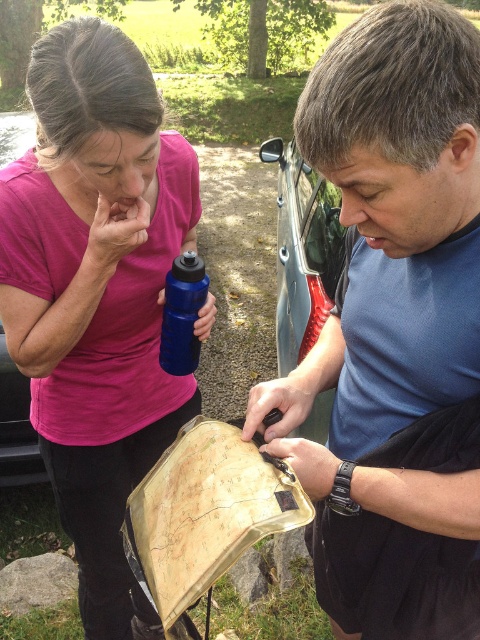
You are planning to pack your backpack for a hike and have both the blue matte water bottle at center and the metallic blue car at left. Which item is shorter and would take up less vertical space in your backpack?

The blue matte water bottle at center is not as tall as the metallic blue car at left, so it is shorter and would take up less vertical space in your backpack.

You are a delivery person who needs to place a metallic silver car at center and a blue matte water bottle at center on a shelf. The shelf has a width of 1.2 meters. Can both items fit side by side without overlapping?

The metallic silver car at center and blue matte water bottle at center are 1.18 meters apart from each other. Since the shelf is 1.2 meters wide, there is enough space for both items to fit side by side without overlapping.

Consider the image. You are a delivery driver who needs to place a new metallic silver car at center onto the matte plastic map at center. Can you place the car directly on top of the map without it overlapping any other objects?

The matte plastic map at center is positioned under metallic silver car at center, so the car is already placed on top of the map without overlapping other objects.